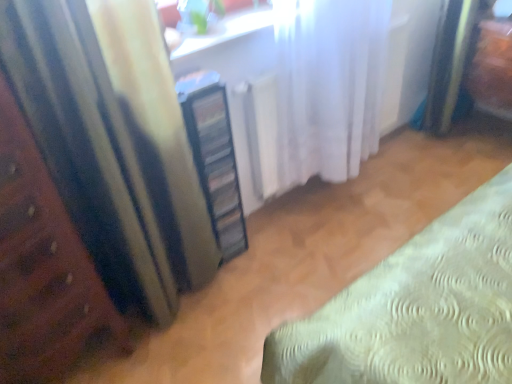
Question: Considering the positions of white sheer curtain at center, the second curtain from the left, and matte yellow curtain at left, the 1th curtain from the left, in the image, is white sheer curtain at center, the second curtain from the left, taller or shorter than matte yellow curtain at left, the 1th curtain from the left,?

Choices:
 (A) tall
 (B) short

Answer: (B)

Question: From the image's perspective, is white sheer curtain at center, the second curtain from the left, located above or below matte yellow curtain at left, the second curtain viewed from the right?

Choices:
 (A) above
 (B) below

Answer: (A)

Question: Considering the real-world distances, which object is farthest from the matte yellow curtain at left, the 1th curtain from the left?

Choices:
 (A) white sheer curtain at center, positioned as the 1th curtain in right-to-left order
 (B) clear plastic cabinet at center
 (C) white glossy window sill at upper center
 (D) wooden bed frame at left

Answer: (A)

Question: Which object is the closest to the wooden bed frame at left?

Choices:
 (A) clear plastic cabinet at center
 (B) matte yellow curtain at left, the second curtain viewed from the right
 (C) white glossy window sill at upper center
 (D) white sheer curtain at center, the second curtain from the left

Answer: (B)